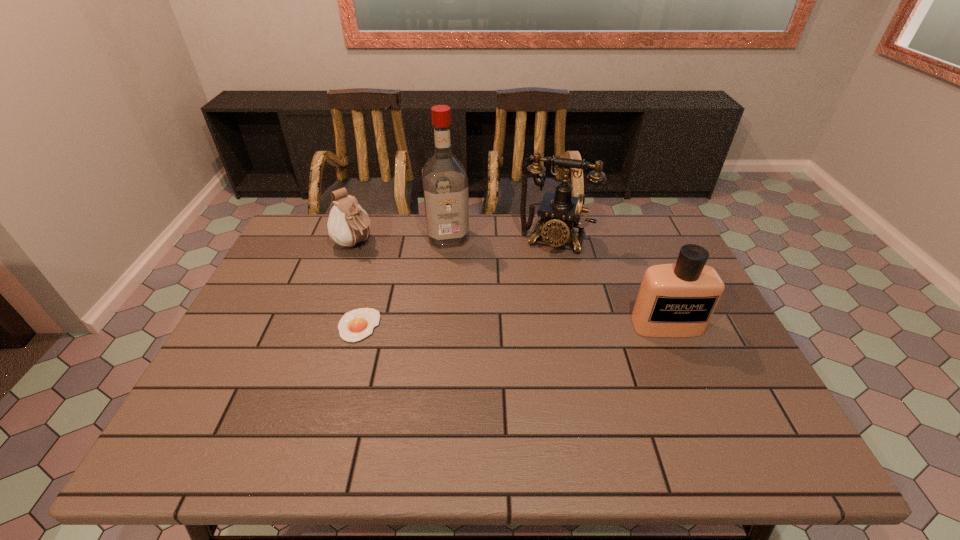
Choose which object is the nearest neighbor to the third shortest object. Please provide its 2D coordinates. Your answer should be formatted as a tuple, i.e. [(x, y)], where the tuple contains the x and y coordinates of a point satisfying the conditions above.

[(560, 212)]

This screenshot has width=960, height=540. I want to click on object that stands as the closest to the rightmost object, so click(x=560, y=212).